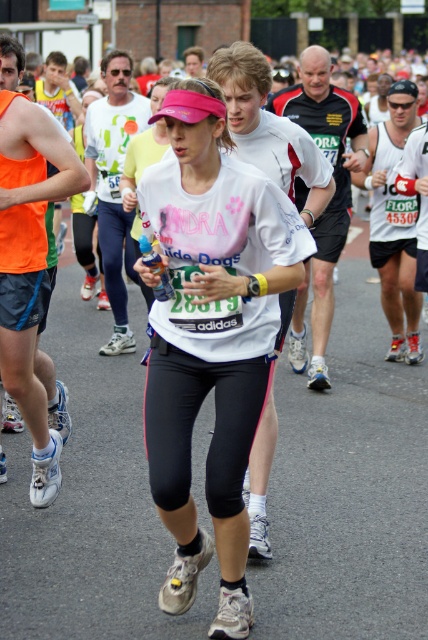
You are a photographer trying to capture the best shot of the marathon runners. You notice two points in the image labeled as point 1 at coordinate (335, 232) and point 2 at coordinate (121, 298). Which point is closer to your camera lens?

Point 1 at coordinate (335, 232) is closer to the camera lens than point 2 at coordinate (121, 298).